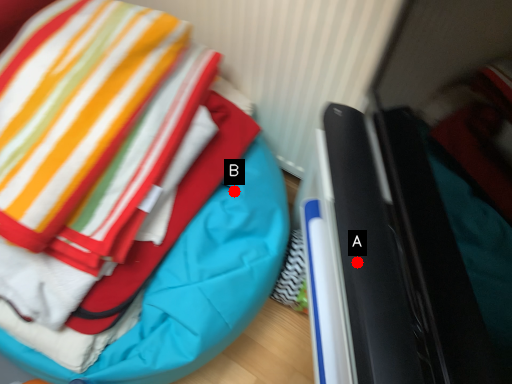
Question: Two points are circled on the image, labeled by A and B beside each circle. Which point is closer to the camera?

Choices:
 (A) A is closer
 (B) B is closer

Answer: (A)